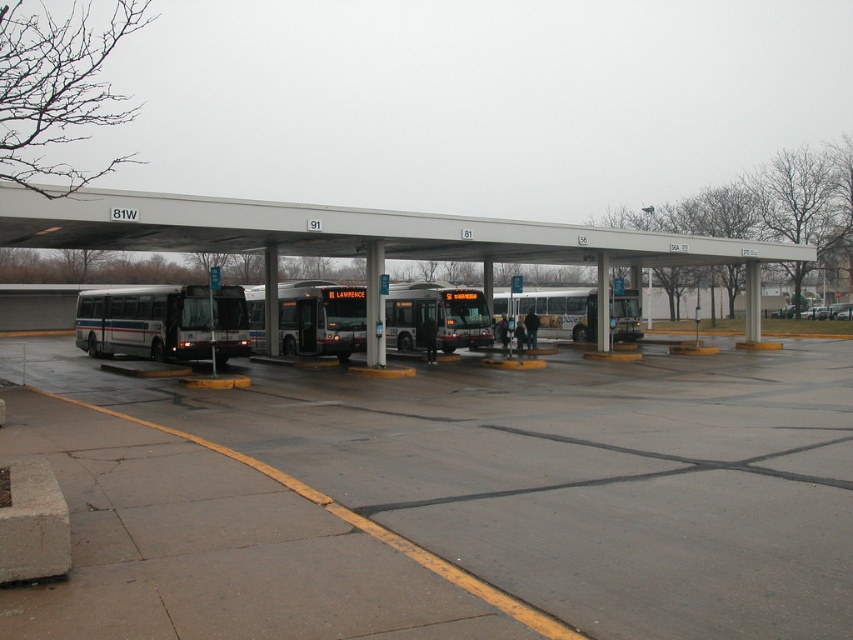
You are a delivery person needing to move a package from the matte black bus at left to the white metallic bus at center. Given that your cart can carry items up to 20 meters, can you transport the package without needing assistance?

The distance between the matte black bus at left and the white metallic bus at center is 20.42 meters, which exceeds the cart capacity of 20 meters. You will need assistance to transport the package.

You are a pedestrian standing at the bus station and want to cross from the matte black bus at left to the concrete parking lot at center. Which direction should you move relative to the bus?

The concrete parking lot at center is positioned on the right side of the matte black bus at left, so you should move to the right relative to the matte black bus at left to reach it.

You are a pedestrian standing at the entrance of the bus station. You want to cross the concrete parking lot at center to reach the white metallic bus at center. Is the parking lot in front of the bus an obstacle for your path?

The concrete parking lot at center is in front of the white metallic bus at center, so it is the path you need to cross to reach the bus. Therefore, it is not an obstacle but the route you should take.